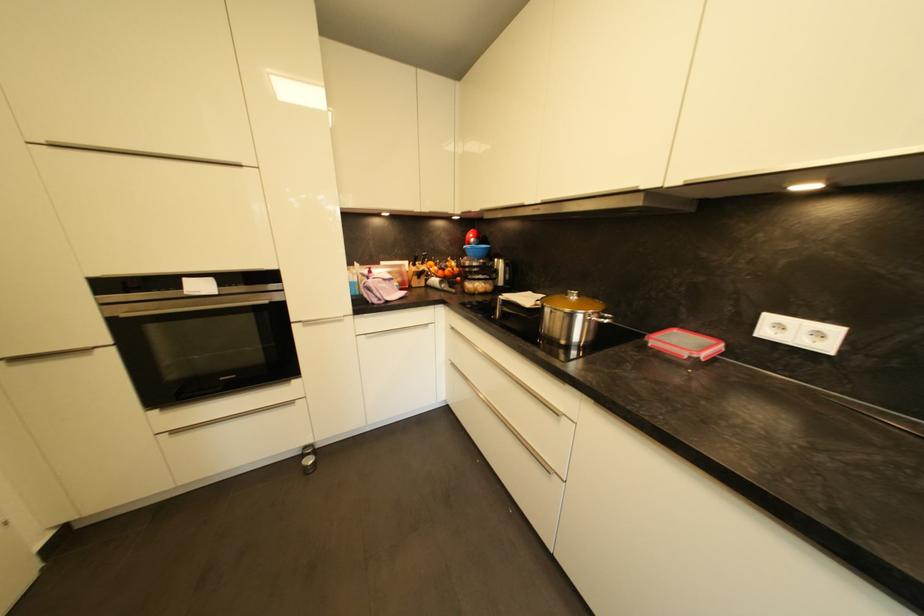
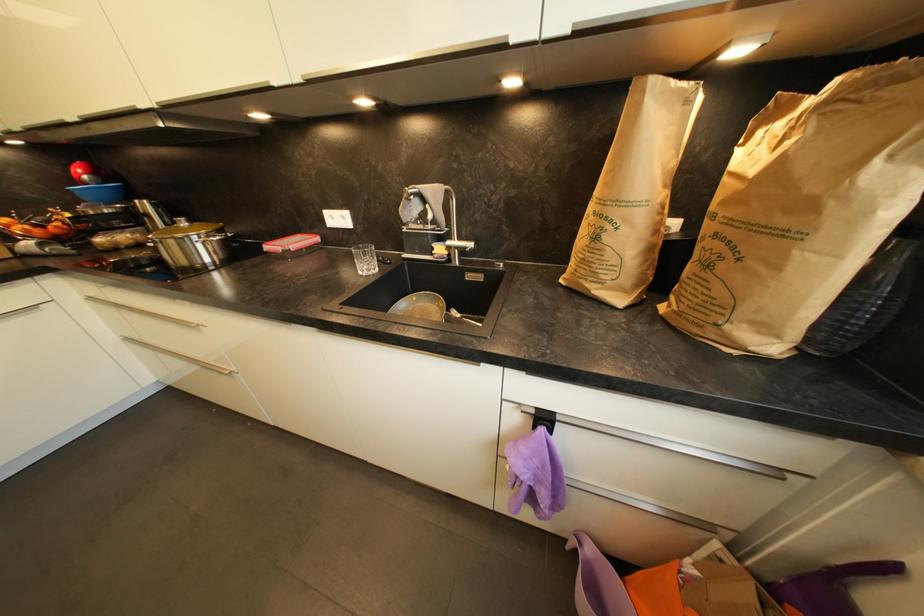
First-person continuous shooting, in which direction is the camera rotating?

The camera's rotation is toward right-down.